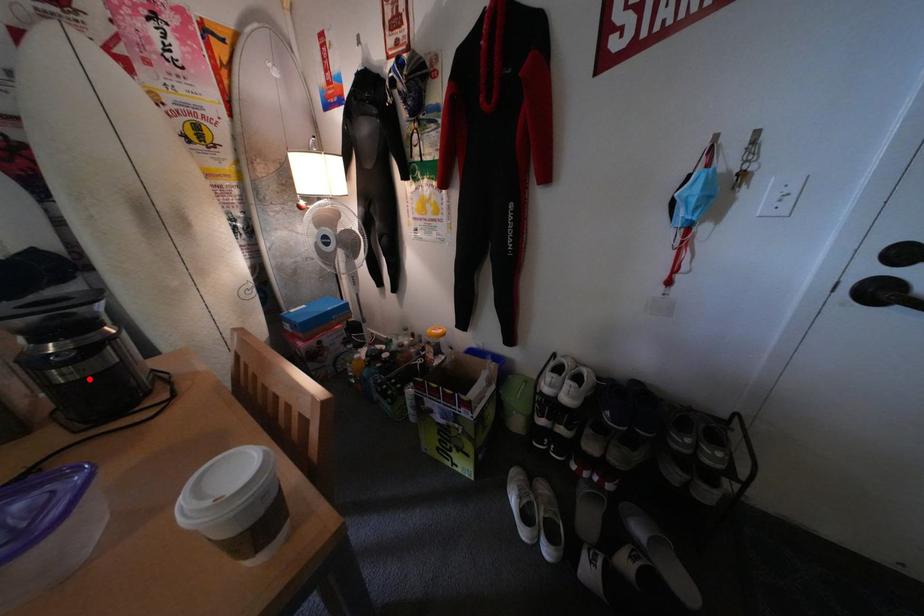
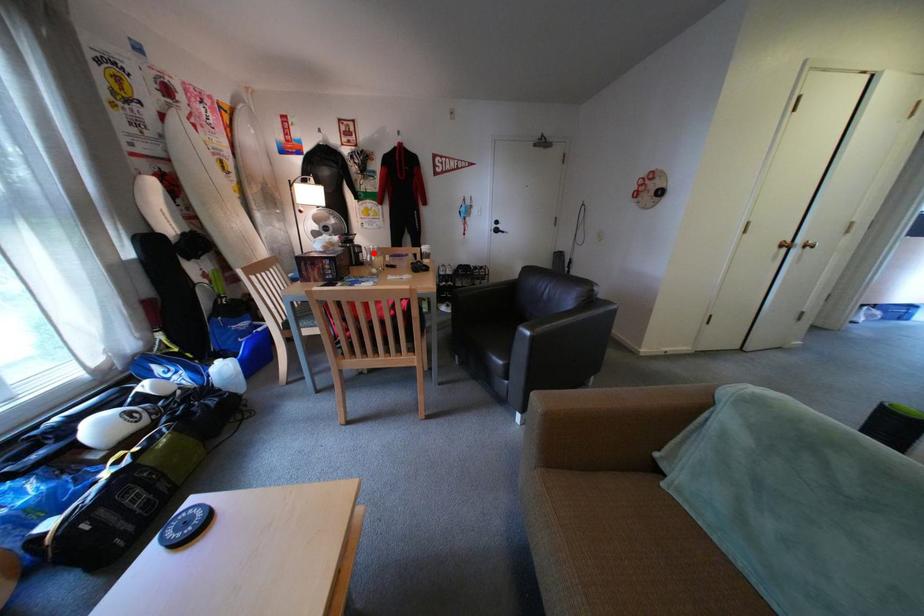
I am providing you with two images of the same scene from different viewpoints. A red point is marked on the first image and another point is marked on the second image. Are the points marked in image1 and image2 representing the same 3D position?

Yes